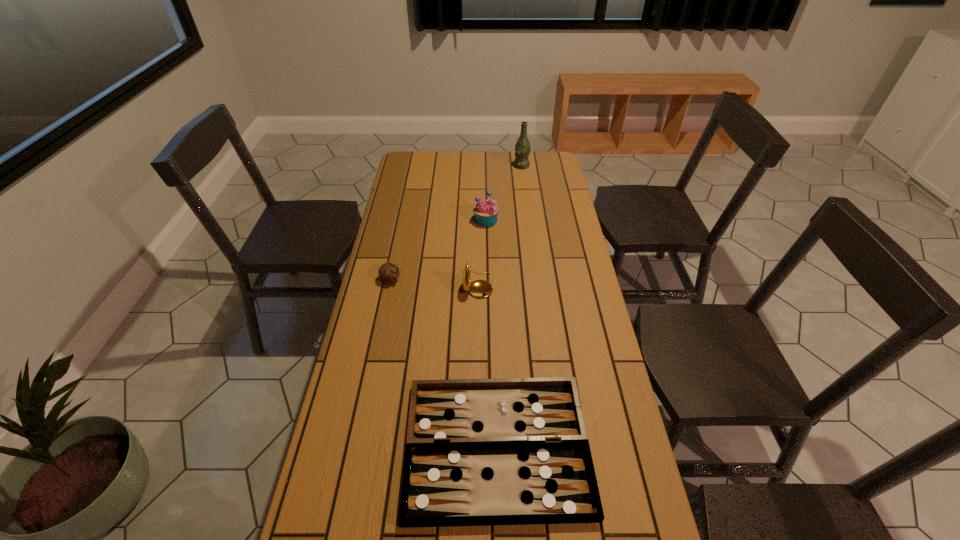
Where is `free space that is in between the farther muffin and the beer bottle`? This screenshot has height=540, width=960. free space that is in between the farther muffin and the beer bottle is located at coordinates (504, 193).

Where is `empty location between the gameboard and the pocket watch`? The width and height of the screenshot is (960, 540). empty location between the gameboard and the pocket watch is located at coordinates (487, 366).

Find the location of a particular element. The height and width of the screenshot is (540, 960). free space between the gameboard and the leftmost object is located at coordinates (444, 362).

What are the coordinates of `free space between the tallest object and the pocket watch` in the screenshot? It's located at (499, 225).

Where is `vacant space in between the left muffin and the beer bottle`? The width and height of the screenshot is (960, 540). vacant space in between the left muffin and the beer bottle is located at coordinates (456, 222).

Image resolution: width=960 pixels, height=540 pixels. Identify the location of the closest object to the nearest object. (480, 288).

Image resolution: width=960 pixels, height=540 pixels. I want to click on the third closest object to the fourth tallest object, so click(x=510, y=451).

Find the location of `vacant area that satisfies the following two spatial constraints: 1. on the face of the pocket watch; 2. on the right side of the nearest object`. vacant area that satisfies the following two spatial constraints: 1. on the face of the pocket watch; 2. on the right side of the nearest object is located at coordinates (476, 447).

This screenshot has height=540, width=960. I want to click on free space in the image that satisfies the following two spatial constraints: 1. on the surface of the beer bottle; 2. on the front side of the nearest object, so click(x=559, y=447).

Locate an element on the screen. vacant space that satisfies the following two spatial constraints: 1. on the back side of the shortest object; 2. on the face of the pocket watch is located at coordinates (492, 284).